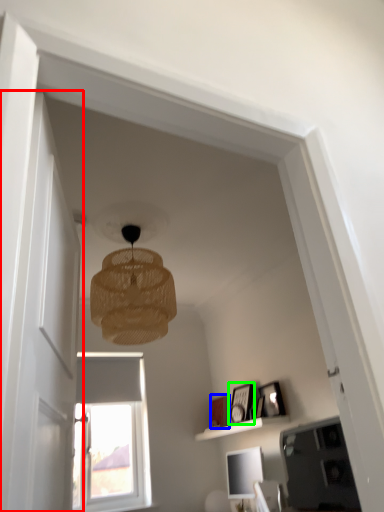
Question: Which object is positioned closest to glass door (highlighted by a red box)? Select from picture frame (highlighted by a blue box) and picture frame (highlighted by a green box).

Choices:
 (A) picture frame
 (B) picture frame

Answer: (B)